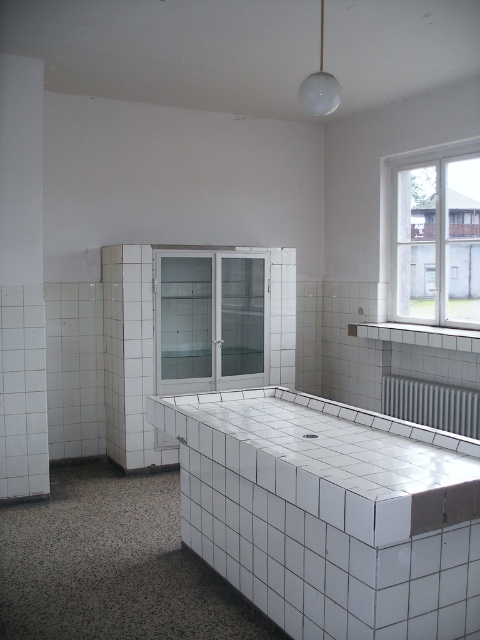
You are a person who is 1.7 meters tall. You want to place a 1.5 meter long object on the white tile counter top at center. Will the object fit on the counter top?

The white tile counter top at center is 2.07 meters away from the viewer, but the question is about the length of the counter top. The provided information does not specify the length of the counter top, so it is impossible to determine if the 1.5 meter long object will fit.

You are organizing items in the utility room and need to place a large appliance that requires 2 meters of space. You have two options for placement areas between the white tile counter top at center and the white glass cabinet at center. Which object provides more width for the appliance?

The white tile counter top at center has a greater width than the white glass cabinet at center, so it can accommodate the appliance needing 2 meters of space better.

You are standing in the utility room and need to place a small appliance on the white tile counter top at center. Where exactly should you place it?

The white tile counter top at center is located at position point (333, 458).